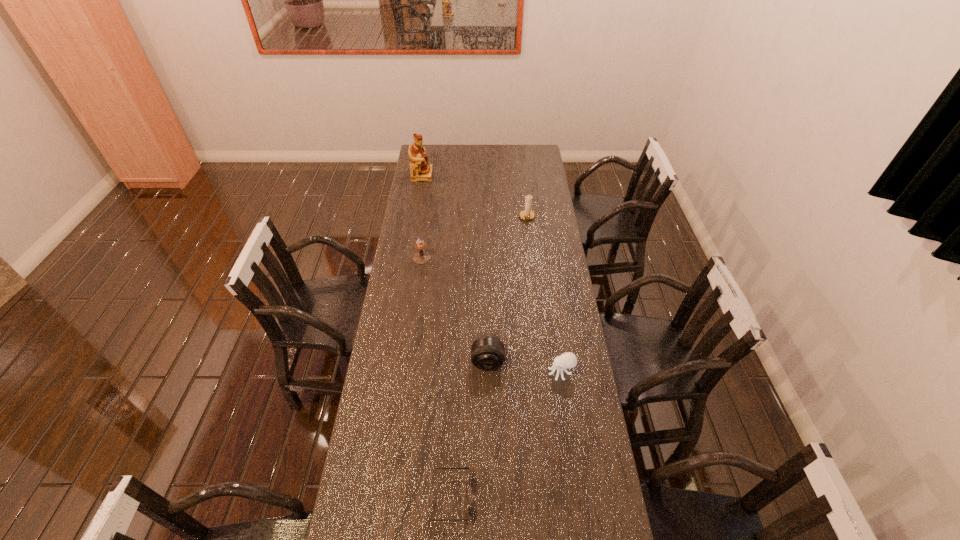
The height and width of the screenshot is (540, 960). Find the location of `figurine`. figurine is located at coordinates pos(421,170).

This screenshot has width=960, height=540. Find the location of `the farthest object`. the farthest object is located at coordinates (421, 170).

Image resolution: width=960 pixels, height=540 pixels. I want to click on the right candle holder, so click(527, 214).

Locate an element on the screen. The image size is (960, 540). the second farthest object is located at coordinates (527, 214).

Find the location of `the left candle holder`. the left candle holder is located at coordinates (421, 257).

Where is `the nearer candle holder`? The width and height of the screenshot is (960, 540). the nearer candle holder is located at coordinates (421, 257).

At what (x,y) coordinates should I click in order to perform the action: click on telephoto lens. Please return your answer as a coordinate pair (x, y). Image resolution: width=960 pixels, height=540 pixels. Looking at the image, I should click on (487, 352).

This screenshot has width=960, height=540. I want to click on the second shortest object, so coord(567,360).

Locate an element on the screen. the nearest object is located at coordinates [461, 467].

Identify the location of sunglasses. (461, 467).